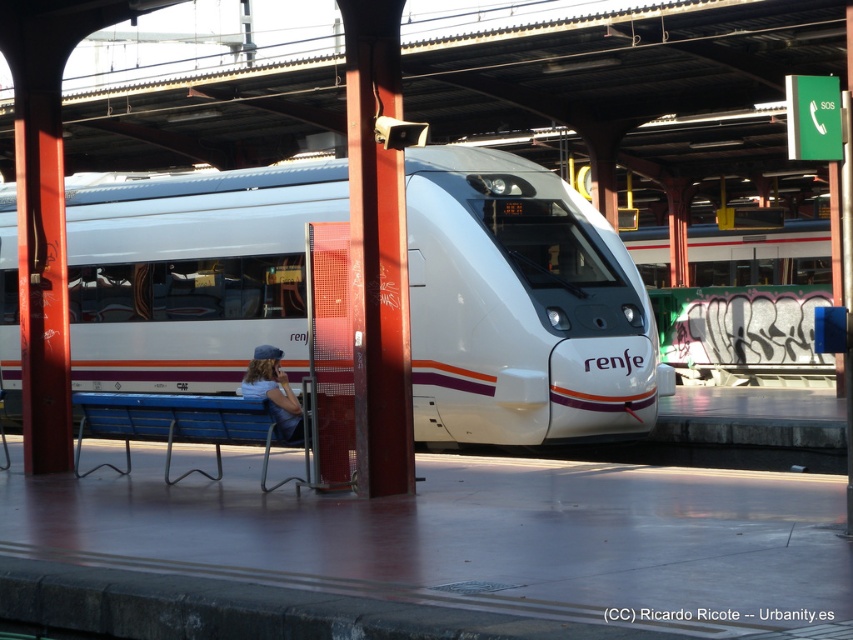
Question: Is white glossy train at center to the right of denim cap at center from the viewer's perspective?

Choices:
 (A) no
 (B) yes

Answer: (A)

Question: Among these objects, which one is nearest to the camera?

Choices:
 (A) white glossy train at center
 (B) denim cap at center

Answer: (B)

Question: Which of the following is the farthest from the observer?

Choices:
 (A) (283, 419)
 (B) (527, 337)

Answer: (B)

Question: Does white glossy train at center have a greater width compared to denim cap at center?

Choices:
 (A) no
 (B) yes

Answer: (B)

Question: Can you confirm if white glossy train at center is thinner than denim cap at center?

Choices:
 (A) yes
 (B) no

Answer: (B)